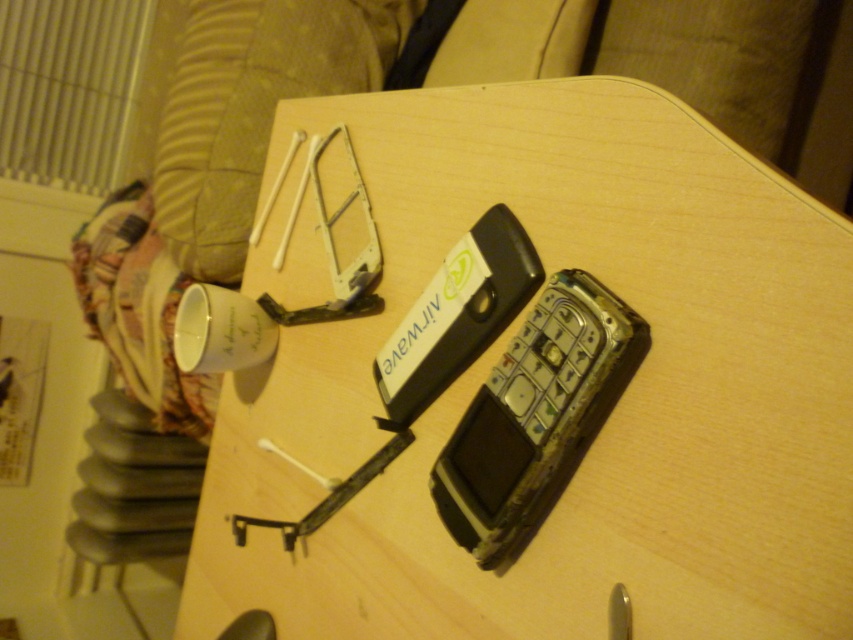
Is wooden table at center bigger than rusty metallic phone at center?

Yes.

This screenshot has height=640, width=853. What do you see at coordinates (538, 381) in the screenshot?
I see `wooden table at center` at bounding box center [538, 381].

The height and width of the screenshot is (640, 853). In order to click on wooden table at center in this screenshot , I will do `click(538, 381)`.